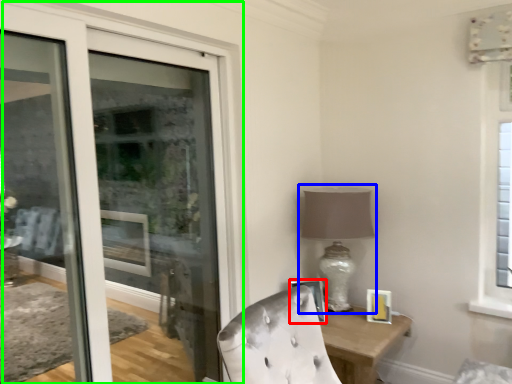
Question: Which is nearer to the picture frame (highlighted by a red box)? table lamp (highlighted by a blue box) or door (highlighted by a green box).

Choices:
 (A) table lamp
 (B) door

Answer: (A)